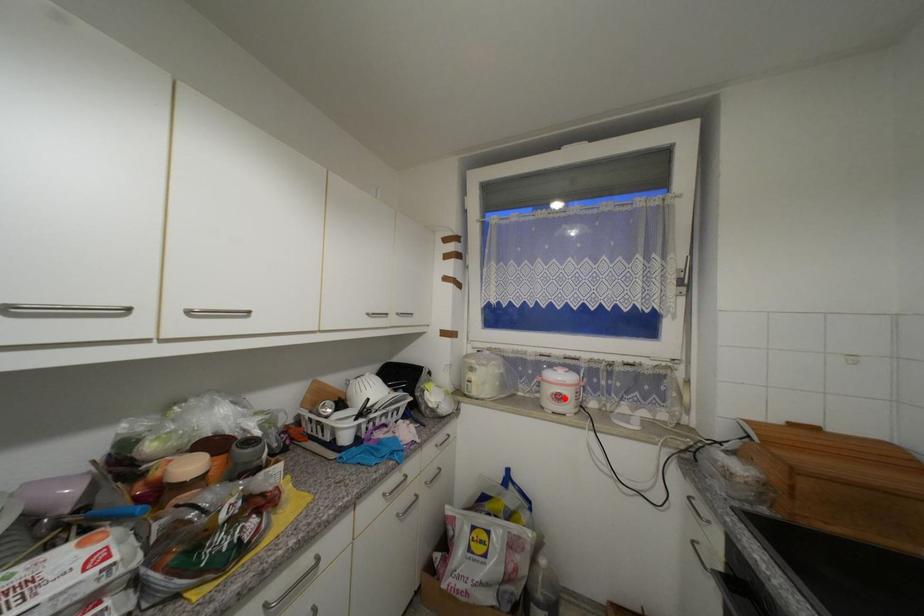
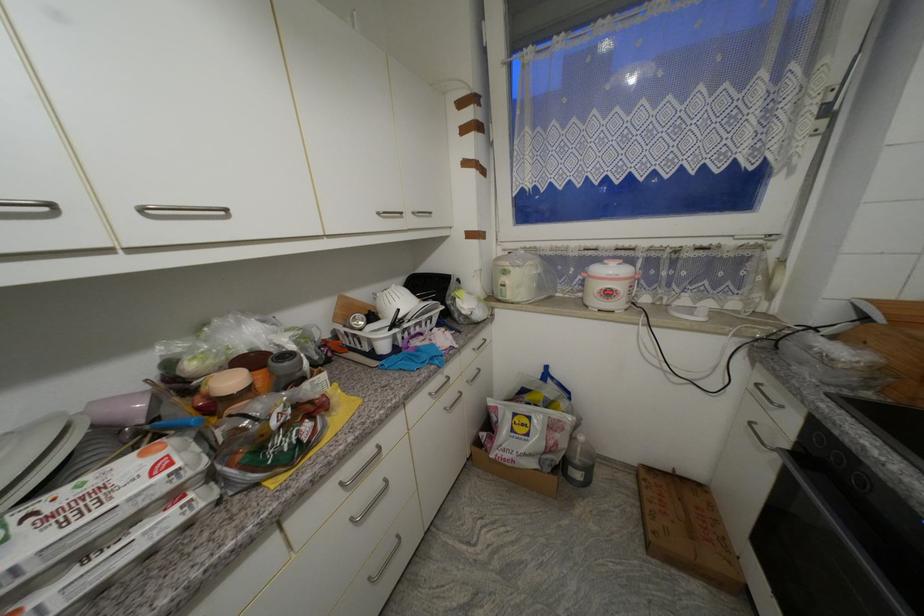
Where in the second image is the point corresponding to the highlighted location from the first image?

(614, 294)